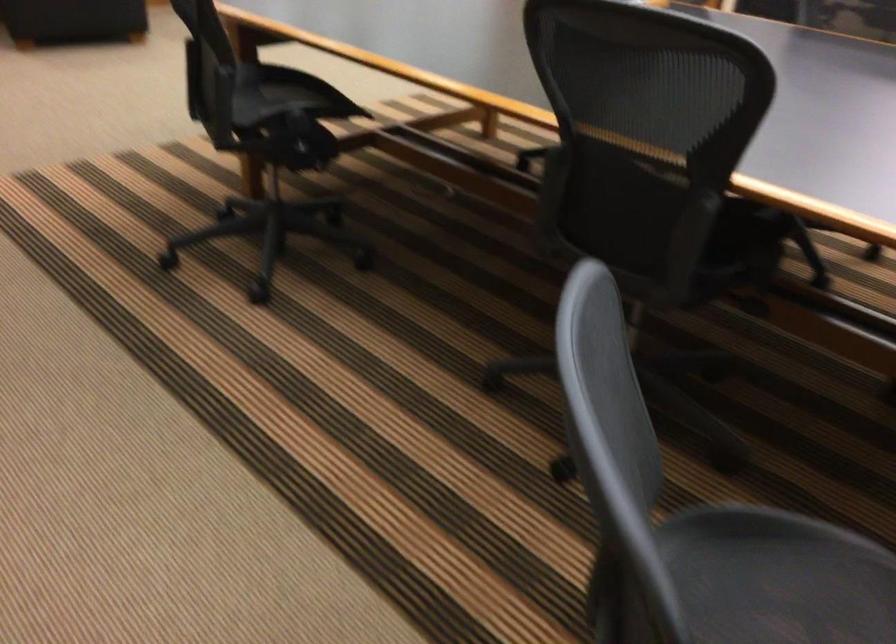
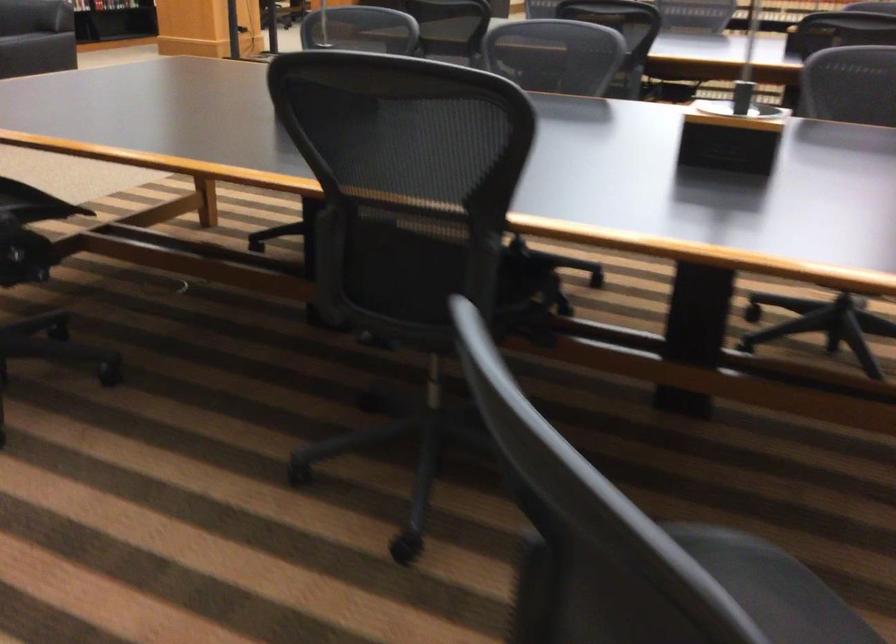
Question: The camera is either moving clockwise (left) or counter-clockwise (right) around the object. The first image is from the beginning of the video and the second image is from the end. Is the camera moving left or right when shooting the video?

Choices:
 (A) Left
 (B) Right

Answer: (A)